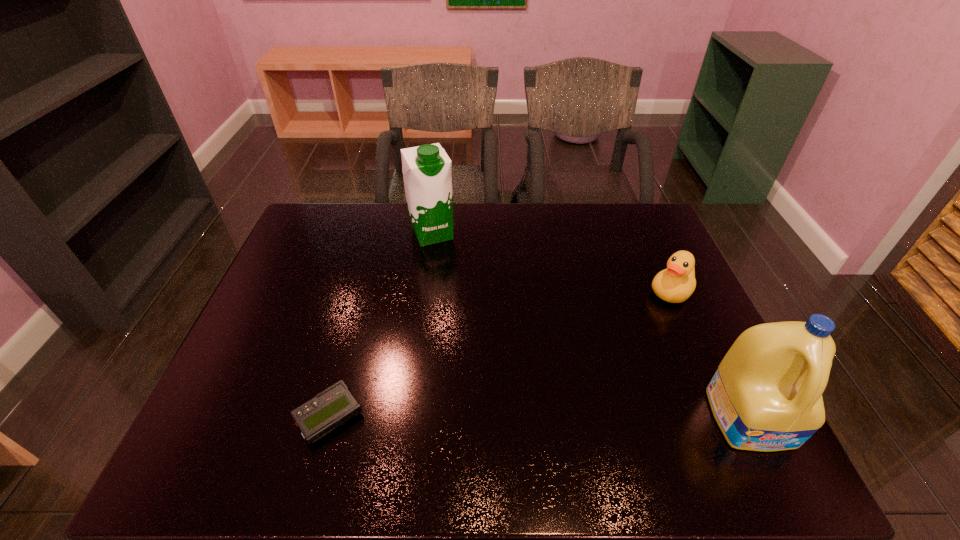
I want to click on free space on the desktop that is between the shortest object and the detergent and is positioned at the beak of the duck, so [x=553, y=417].

I want to click on free spot on the desktop that is between the beeper and the detergent and is positioned on the front-facing side of the farthest object, so click(x=523, y=417).